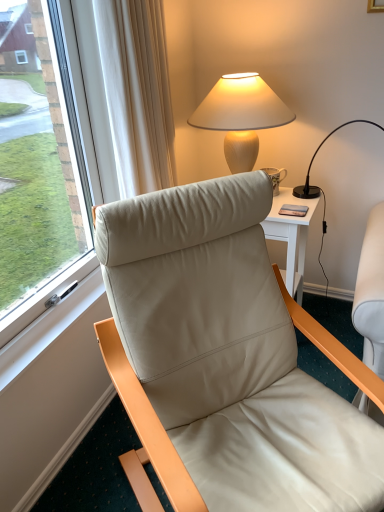
Question: Can you confirm if leather at left is thinner than black glass lamp at upper right, which is the first lamp in right-to-left order?

Choices:
 (A) no
 (B) yes

Answer: (A)

Question: Does leather at left have a greater width compared to black glass lamp at upper right, which is the first lamp in right-to-left order?

Choices:
 (A) yes
 (B) no

Answer: (A)

Question: From the image's perspective, is leather at left located above black glass lamp at upper right, arranged as the 2th lamp when viewed from the left?

Choices:
 (A) no
 (B) yes

Answer: (A)

Question: From a real-world perspective, does leather at left sit lower than black glass lamp at upper right, arranged as the 2th lamp when viewed from the left?

Choices:
 (A) no
 (B) yes

Answer: (B)

Question: Can you confirm if leather at left is bigger than black glass lamp at upper right, which is the first lamp in right-to-left order?

Choices:
 (A) yes
 (B) no

Answer: (A)

Question: In terms of height, does porcelain floral mug at right look taller or shorter compared to leather at left?

Choices:
 (A) tall
 (B) short

Answer: (B)

Question: Relative to leather at left, is porcelain floral mug at right in front or behind?

Choices:
 (A) front
 (B) behind

Answer: (B)

Question: Considering the relative positions of porcelain floral mug at right and leather at left in the image provided, is porcelain floral mug at right to the left or to the right of leather at left?

Choices:
 (A) left
 (B) right

Answer: (B)

Question: Is porcelain floral mug at right inside the boundaries of leather at left, or outside?

Choices:
 (A) inside
 (B) outside

Answer: (B)

Question: In terms of size, does porcelain floral mug at right appear bigger or smaller than matte black phone at upper right?

Choices:
 (A) big
 (B) small

Answer: (A)

Question: In the image, is porcelain floral mug at right positioned in front of or behind matte black phone at upper right?

Choices:
 (A) behind
 (B) front

Answer: (A)

Question: In the image, is porcelain floral mug at right on the left side or the right side of matte black phone at upper right?

Choices:
 (A) right
 (B) left

Answer: (B)

Question: From a real-world perspective, is porcelain floral mug at right positioned above or below matte black phone at upper right?

Choices:
 (A) above
 (B) below

Answer: (A)

Question: From the image's perspective, is black glass lamp at upper right, arranged as the 2th lamp when viewed from the left, above or below matte black phone at upper right?

Choices:
 (A) above
 (B) below

Answer: (A)

Question: Looking at their shapes, would you say black glass lamp at upper right, which is the first lamp in right-to-left order, is wider or thinner than matte black phone at upper right?

Choices:
 (A) thin
 (B) wide

Answer: (B)